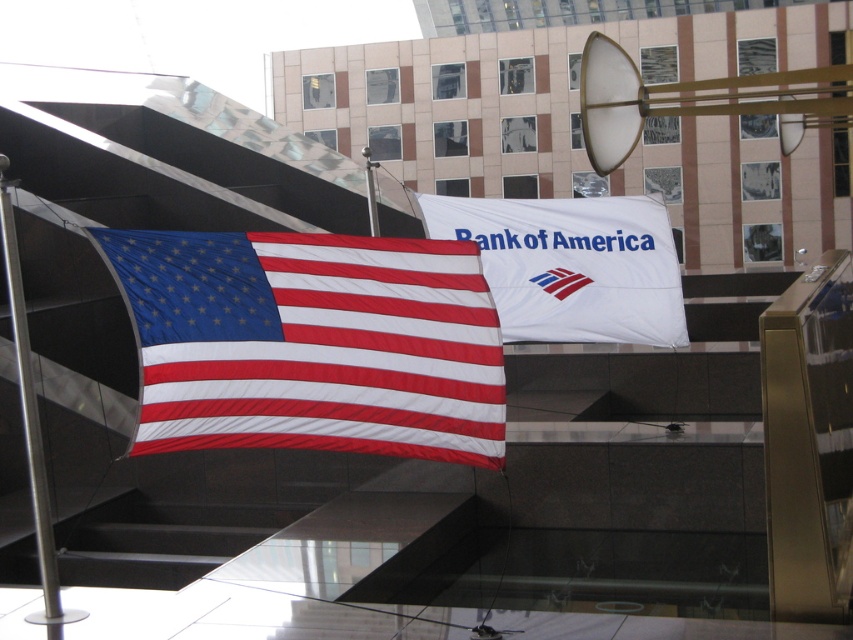
Question: Which of the following is the farthest from the observer?

Choices:
 (A) white matte flag at center
 (B) matte fabric flag at center
 (C) silver metallic pole at left

Answer: (A)

Question: Does matte fabric flag at center come behind white matte flag at center?

Choices:
 (A) yes
 (B) no

Answer: (B)

Question: Estimate the real-world distances between objects in this image. Which object is farther from the silver metallic pole at left?

Choices:
 (A) matte fabric flag at center
 (B) white matte flag at center

Answer: (B)

Question: Which point is closer to the camera?

Choices:
 (A) silver metallic pole at left
 (B) white matte flag at center
 (C) matte fabric flag at center

Answer: (C)

Question: From the image, what is the correct spatial relationship of white matte flag at center in relation to silver metallic pole at left?

Choices:
 (A) below
 (B) above

Answer: (B)

Question: Is matte fabric flag at center below white matte flag at center?

Choices:
 (A) no
 (B) yes

Answer: (B)